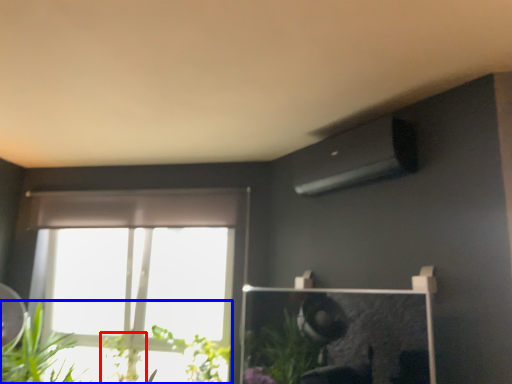
Question: Which point is further to the camera, plant (highlighted by a red box) or houseplant (highlighted by a blue box)?

Choices:
 (A) plant
 (B) houseplant

Answer: (A)